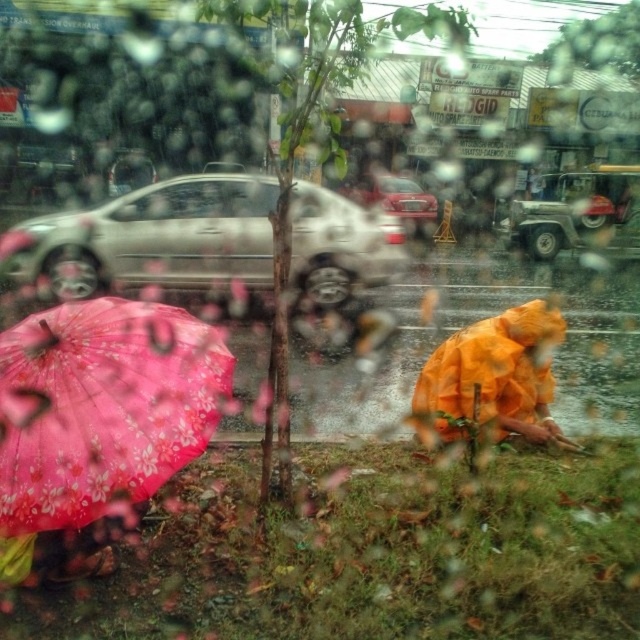
Who is more forward, (545, 355) or (403, 204)?

Positioned in front is point (545, 355).

Is point (467, 355) closer to camera compared to point (396, 184)?

Yes, it is.

At what (x,y) coordinates should I click in order to perform the action: click on orange waterproof coat at lower right. Please return your answer as a coordinate pair (x, y). Looking at the image, I should click on (492, 376).

Between metallic silver jeep at right and shiny red sedan at center, which one is positioned lower?

metallic silver jeep at right is lower down.

Who is taller, metallic silver jeep at right or shiny red sedan at center?

Standing taller between the two is metallic silver jeep at right.

Describe the element at coordinates (579, 212) in the screenshot. I see `metallic silver jeep at right` at that location.

Where is `metallic silver jeep at right`? Image resolution: width=640 pixels, height=640 pixels. metallic silver jeep at right is located at coordinates (579, 212).

In the scene shown: Who is shorter, pink floral fabric umbrella at lower left or metallic silver jeep at right?

With less height is pink floral fabric umbrella at lower left.

Which is more to the left, pink floral fabric umbrella at lower left or metallic silver jeep at right?

Positioned to the left is pink floral fabric umbrella at lower left.

Between point (67, 352) and point (602, 211), which one is positioned behind?

Positioned behind is point (602, 211).

Locate an element on the screen. The image size is (640, 640). pink floral fabric umbrella at lower left is located at coordinates (102, 406).